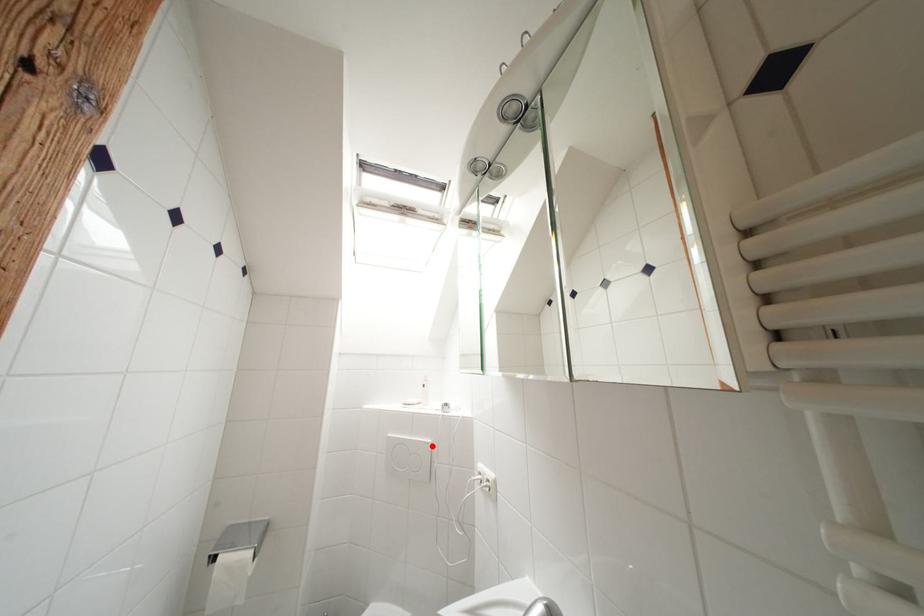
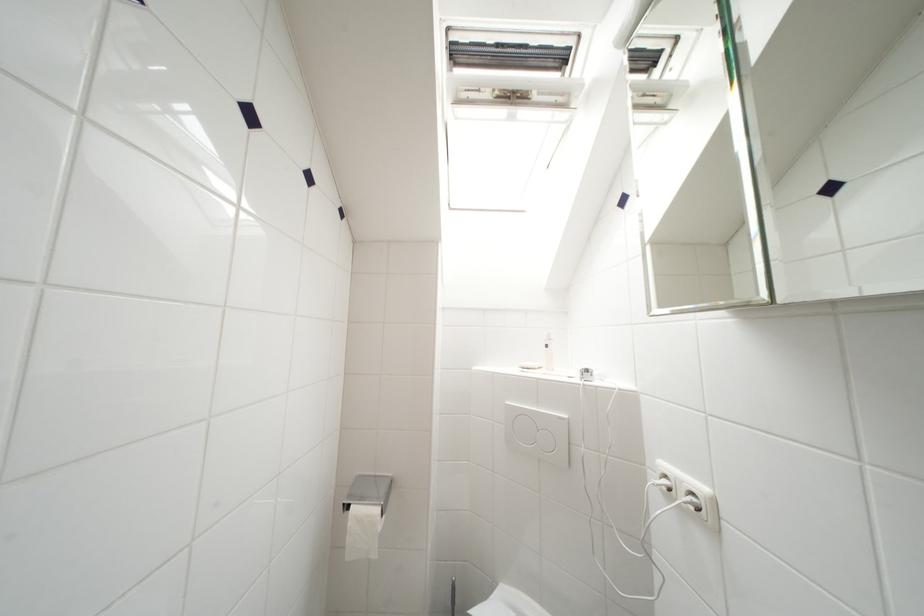
Find the pixel in the second image that matches the highlighted location in the first image.

(565, 421)